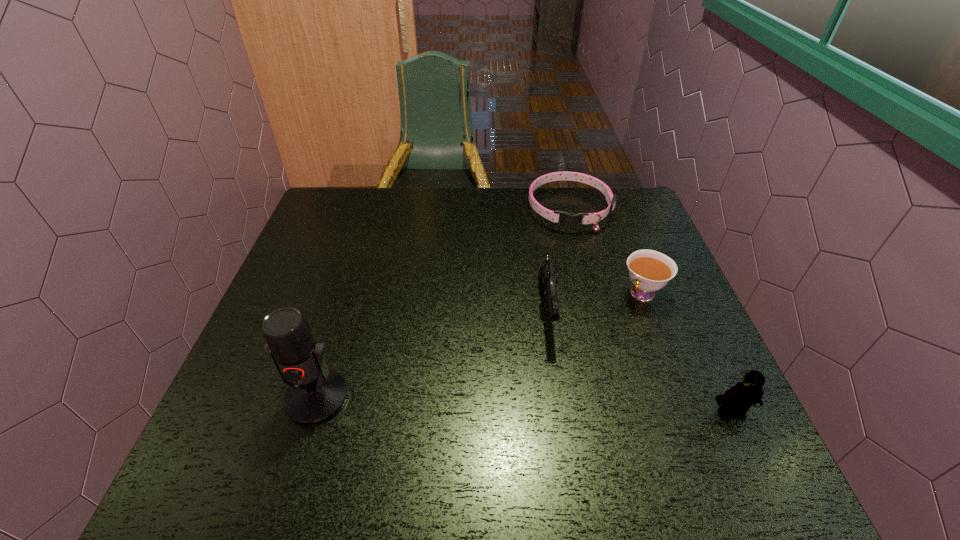
I want to click on vacant region located with the buckle on the shortest object, so click(x=573, y=266).

Where is `free space located 0.170m with the buckle on the shortest object`? The height and width of the screenshot is (540, 960). free space located 0.170m with the buckle on the shortest object is located at coordinates (573, 273).

Find the location of `vacant space located with the buckle on the shortest object`. vacant space located with the buckle on the shortest object is located at coordinates (577, 323).

This screenshot has width=960, height=540. I want to click on free spot located at the end of the barrel of the gun, so click(559, 412).

Find the location of `free space located 0.160m at the end of the barrel of the gun`. free space located 0.160m at the end of the barrel of the gun is located at coordinates coord(559,412).

Where is `vacant point located 0.120m at the end of the barrel of the gun`? This screenshot has height=540, width=960. vacant point located 0.120m at the end of the barrel of the gun is located at coordinates (557, 395).

This screenshot has width=960, height=540. In order to click on object located in the far edge section of the desktop in this screenshot , I will do `click(568, 219)`.

The height and width of the screenshot is (540, 960). I want to click on microphone located at the near edge, so click(316, 394).

Where is `Lego located at the near edge`? The image size is (960, 540). Lego located at the near edge is located at coordinates (735, 402).

You are a GUI agent. You are given a task and a screenshot of the screen. Output one action in this format:
    pyautogui.click(x=<x>, y=<y>)
    Task: Click on the object present at the left edge
    The width and height of the screenshot is (960, 540).
    Given the screenshot: What is the action you would take?
    pyautogui.click(x=316, y=394)